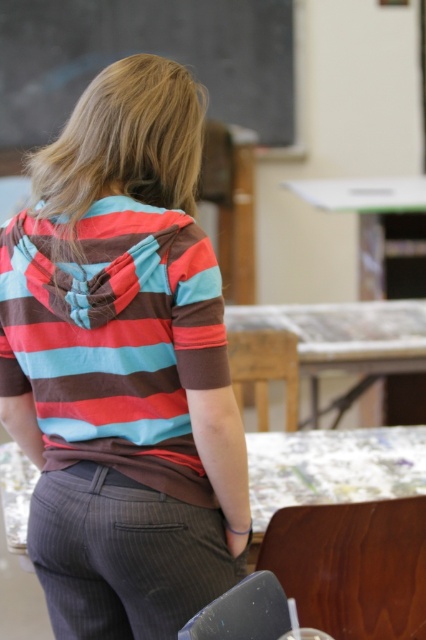
Question: Which object is the farthest from the green plastic table at upper center?

Choices:
 (A) wooden table at center
 (B) black chalkboard at upper center
 (C) striped cotton hoodie at center

Answer: (C)

Question: Is striped cotton hoodie at center above wooden table at center?

Choices:
 (A) yes
 (B) no

Answer: (A)

Question: Which point is closer to the camera?

Choices:
 (A) (244, 445)
 (B) (382, 275)
 (C) (379, 355)
 (D) (106, 29)

Answer: (A)

Question: Among these objects, which one is farthest from the camera?

Choices:
 (A) wooden table at center
 (B) black chalkboard at upper center
 (C) striped cotton hoodie at center
 (D) green plastic table at upper center

Answer: (B)

Question: Is striped cotton hoodie at center bigger than green plastic table at upper center?

Choices:
 (A) yes
 (B) no

Answer: (B)

Question: Is striped cotton hoodie at center bigger than green plastic table at upper center?

Choices:
 (A) yes
 (B) no

Answer: (B)